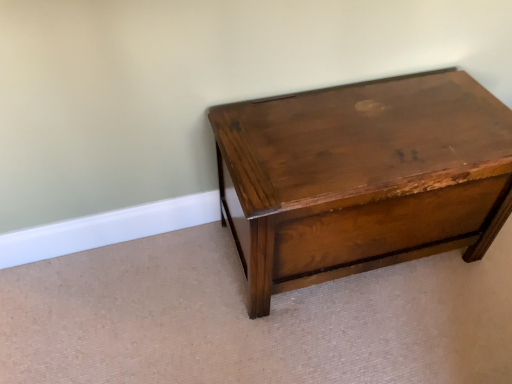
This screenshot has width=512, height=384. In order to click on free spot above shiny brown wood chest at center (from a real-world perspective) in this screenshot , I will do `click(353, 144)`.